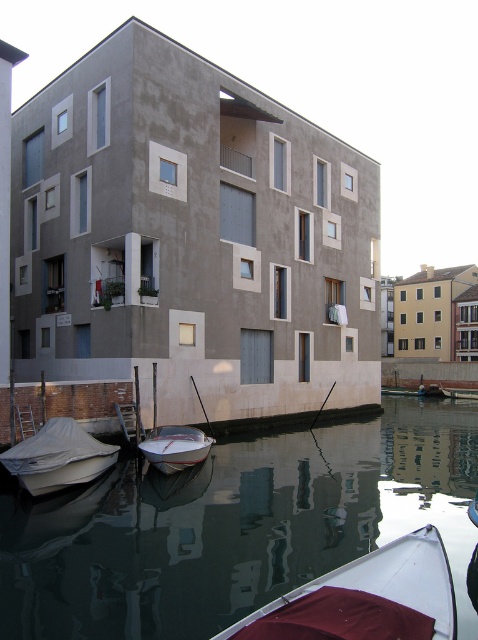
Question: Is smooth reflective water at lower center positioned in front of white glossy boat at lower center?

Choices:
 (A) no
 (B) yes

Answer: (B)

Question: Does white matte boat at lower right have a smaller size compared to white matte boat at lower left?

Choices:
 (A) no
 (B) yes

Answer: (B)

Question: Does smooth reflective water at lower center appear on the left side of white matte boat at lower right?

Choices:
 (A) no
 (B) yes

Answer: (B)

Question: Among these objects, which one is farthest from the camera?

Choices:
 (A) white matte boat at lower right
 (B) smooth reflective water at lower center

Answer: (B)

Question: Which point is closer to the camera taking this photo?

Choices:
 (A) (198, 460)
 (B) (297, 573)
 (C) (453, 605)
 (D) (44, 477)

Answer: (C)

Question: Which point is farther from the camera taking this photo?

Choices:
 (A) [152, 456]
 (B) [9, 449]
 (C) [414, 544]
 (D) [177, 488]

Answer: (A)